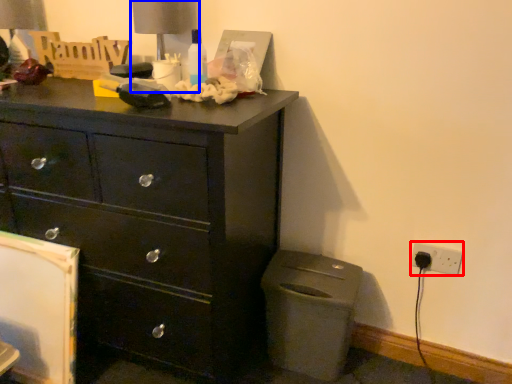
Question: Which of the following is the farthest to the observer, electric outlet (highlighted by a red box) or table lamp (highlighted by a blue box)?

Choices:
 (A) electric outlet
 (B) table lamp

Answer: (A)